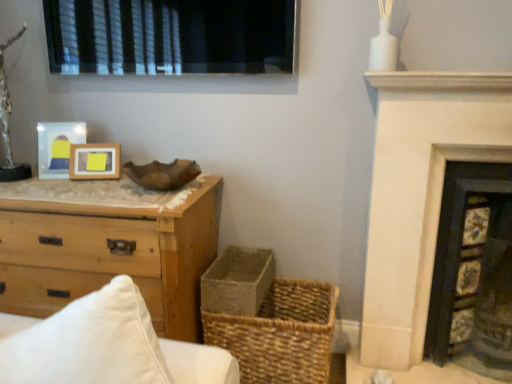
Question: Is white stone fireplace at upper right, the second fireplace viewed from the right, to the right of woven straw basket at lower center from the viewer's perspective?

Choices:
 (A) yes
 (B) no

Answer: (A)

Question: From the image's perspective, would you say white stone fireplace at upper right, the second fireplace viewed from the right, is positioned over woven straw basket at lower center?

Choices:
 (A) no
 (B) yes

Answer: (B)

Question: Is white stone fireplace at upper right, which is counted as the first fireplace, starting from the left, oriented towards woven straw basket at lower center?

Choices:
 (A) yes
 (B) no

Answer: (B)

Question: Considering the relative positions of white stone fireplace at upper right, the second fireplace viewed from the right, and woven straw basket at lower center in the image provided, is white stone fireplace at upper right, the second fireplace viewed from the right, to the left of woven straw basket at lower center from the viewer's perspective?

Choices:
 (A) yes
 (B) no

Answer: (B)

Question: Is white stone fireplace at upper right, which is counted as the first fireplace, starting from the left, bigger than woven straw basket at lower center?

Choices:
 (A) no
 (B) yes

Answer: (B)

Question: Is wooden frame at center, the second picture frame viewed from the left, situated inside black matte window at upper center or outside?

Choices:
 (A) inside
 (B) outside

Answer: (B)

Question: From the image's perspective, is wooden frame at center, the second picture frame viewed from the left, above or below black matte window at upper center?

Choices:
 (A) below
 (B) above

Answer: (A)

Question: Visually, is wooden frame at center, which appears as the first picture frame when viewed from the right, positioned to the left or to the right of black matte window at upper center?

Choices:
 (A) left
 (B) right

Answer: (A)

Question: Relative to black matte window at upper center, is wooden frame at center, the second picture frame viewed from the left, in front or behind?

Choices:
 (A) behind
 (B) front

Answer: (A)

Question: From their relative heights in the image, would you say rustic woven basket at lower center is taller or shorter than black matte window at upper center?

Choices:
 (A) short
 (B) tall

Answer: (A)

Question: From the image's perspective, is rustic woven basket at lower center located above or below black matte window at upper center?

Choices:
 (A) below
 (B) above

Answer: (A)

Question: Is rustic woven basket at lower center spatially inside black matte window at upper center, or outside of it?

Choices:
 (A) outside
 (B) inside

Answer: (A)

Question: Considering their positions, is rustic woven basket at lower center located in front of or behind black matte window at upper center?

Choices:
 (A) front
 (B) behind

Answer: (B)

Question: Is point (250, 8) positioned closer to the camera than point (499, 372)?

Choices:
 (A) farther
 (B) closer

Answer: (B)

Question: Is black matte window at upper center inside the boundaries of dark gray stone fireplace at right, marked as the 2th fireplace in a left-to-right arrangement, or outside?

Choices:
 (A) outside
 (B) inside

Answer: (A)